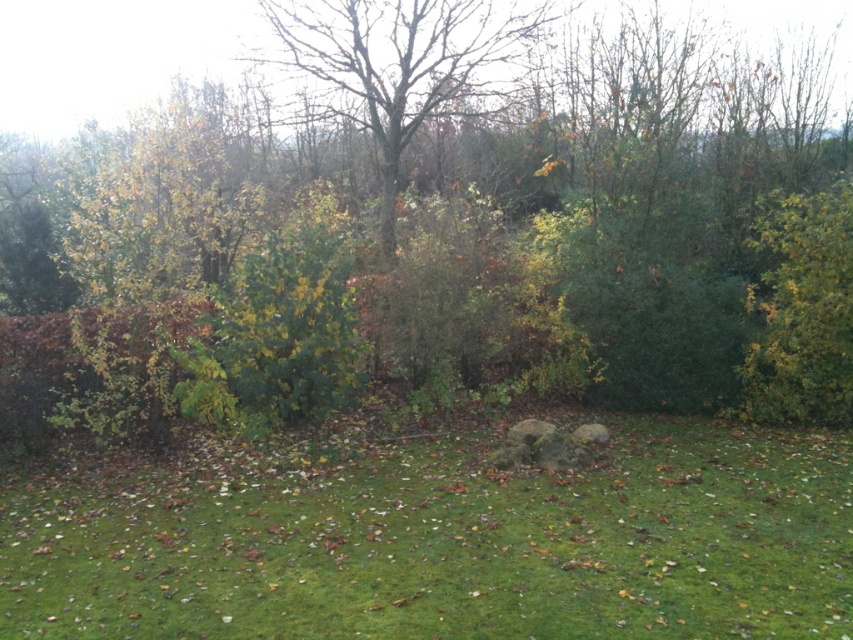
Is point (466, 157) more distant than point (90, 593)?

Yes, point (466, 157) is farther from viewer.

Who is positioned more to the right, green leafy tree at center or green grassy area at center?

green grassy area at center is more to the right.

Is point (708, 237) farther from camera compared to point (160, 488)?

Yes.

This screenshot has height=640, width=853. What are the coordinates of `green leafy tree at center` in the screenshot? It's located at click(503, 198).

Who is taller, green leafy tree at center or green leafy bush at center?

green leafy tree at center is taller.

Where is `green leafy tree at center`? green leafy tree at center is located at coordinates (503, 198).

Which is behind, point (706, 371) or point (341, 365)?

The point (706, 371) is more distant.

Where is `green leafy tree at center`? green leafy tree at center is located at coordinates (503, 198).

The height and width of the screenshot is (640, 853). What do you see at coordinates (279, 330) in the screenshot?
I see `green leafy bush at center` at bounding box center [279, 330].

The height and width of the screenshot is (640, 853). Find the location of `green leafy bush at center`. green leafy bush at center is located at coordinates (279, 330).